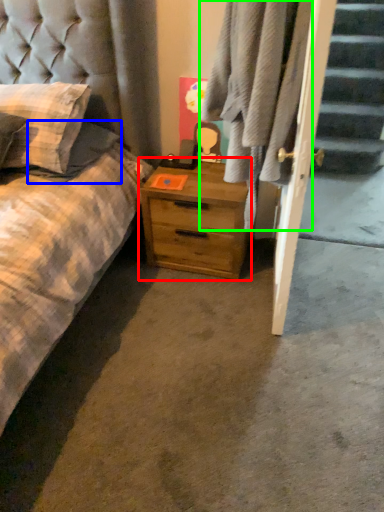
Question: Which is farther away from nightstand (highlighted by a red box)? pillow (highlighted by a blue box) or plaid (highlighted by a green box)?

Choices:
 (A) pillow
 (B) plaid

Answer: (A)